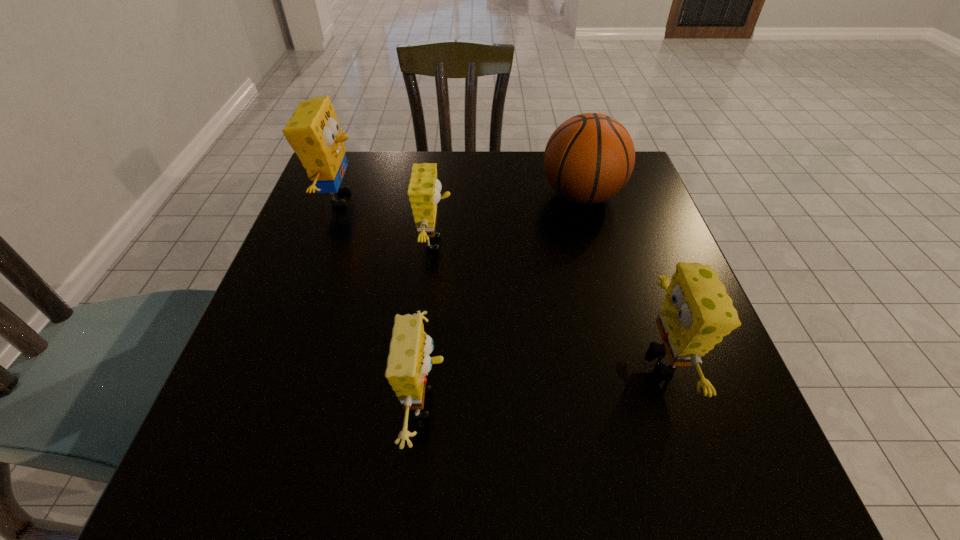
I want to click on sponge identified as the third closest to the leftmost object, so click(696, 314).

Locate an element on the screen. This screenshot has height=540, width=960. sponge that is the closest to the leftmost sponge is located at coordinates (424, 189).

The width and height of the screenshot is (960, 540). Identify the location of free region that satisfies the following two spatial constraints: 1. on the front side of the basketball; 2. on the face of the leftmost object. (583, 198).